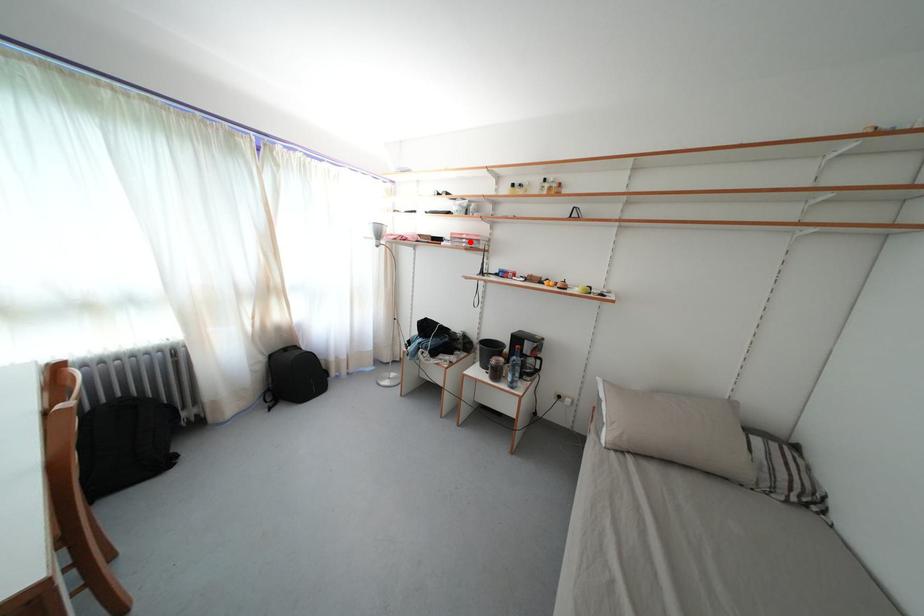
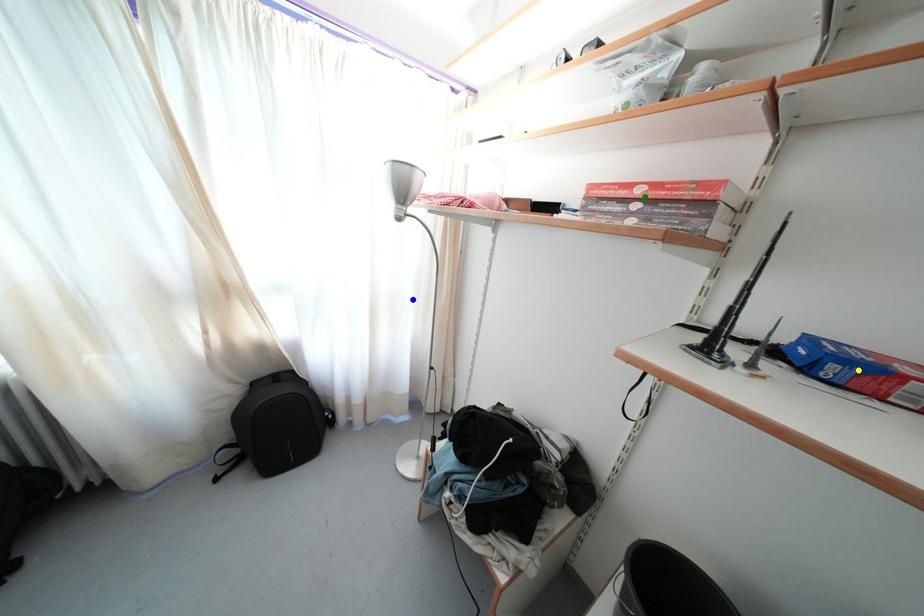
Question: I am providing you with two images of the same scene from different viewpoints. A red point is marked on the first image. You are given multiple points on the second image. Which mark in image 2 goes with the point in image 1?

Choices:
 (A) yellow point
 (B) green point
 (C) blue point

Answer: (B)